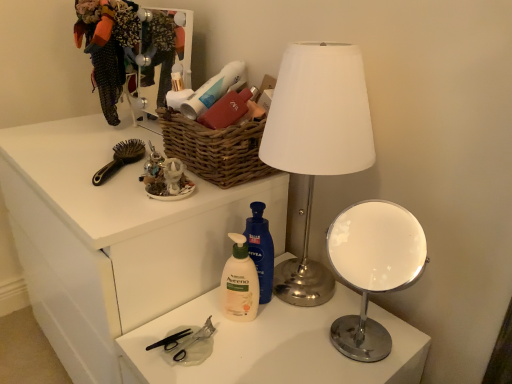
Find the location of `free space to the left of black plastic scissors at lower center`. free space to the left of black plastic scissors at lower center is located at coordinates (147, 345).